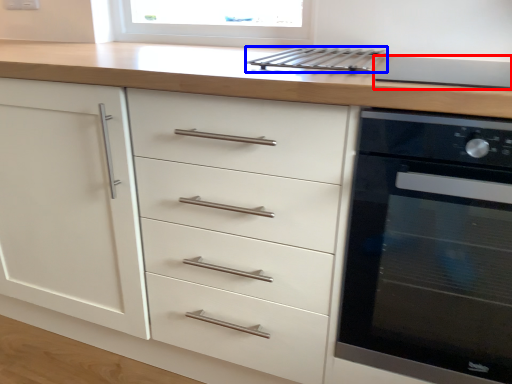
Question: Which point is closer to the camera, appliance (highlighted by a red box) or kitchen appliance (highlighted by a blue box)?

Choices:
 (A) appliance
 (B) kitchen appliance

Answer: (A)